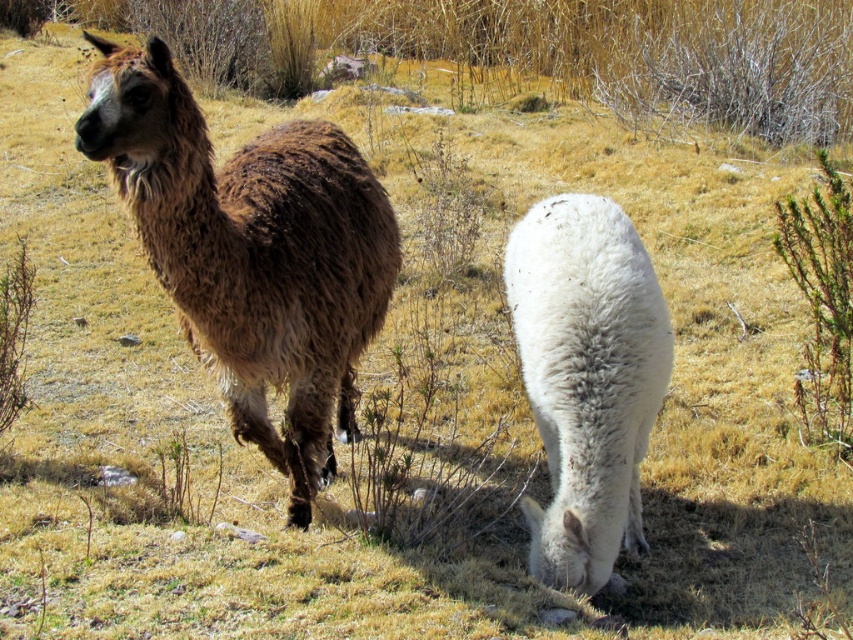
Who is taller, brown woolly alpaca at left or white woolen llama at center?

With more height is brown woolly alpaca at left.

Between brown woolly alpaca at left and white woolen llama at center, which one is positioned higher?

brown woolly alpaca at left

Which is in front, point (195, 314) or point (563, 339)?

Point (195, 314)

This screenshot has width=853, height=640. Find the location of `brown woolly alpaca at left`. brown woolly alpaca at left is located at coordinates (251, 252).